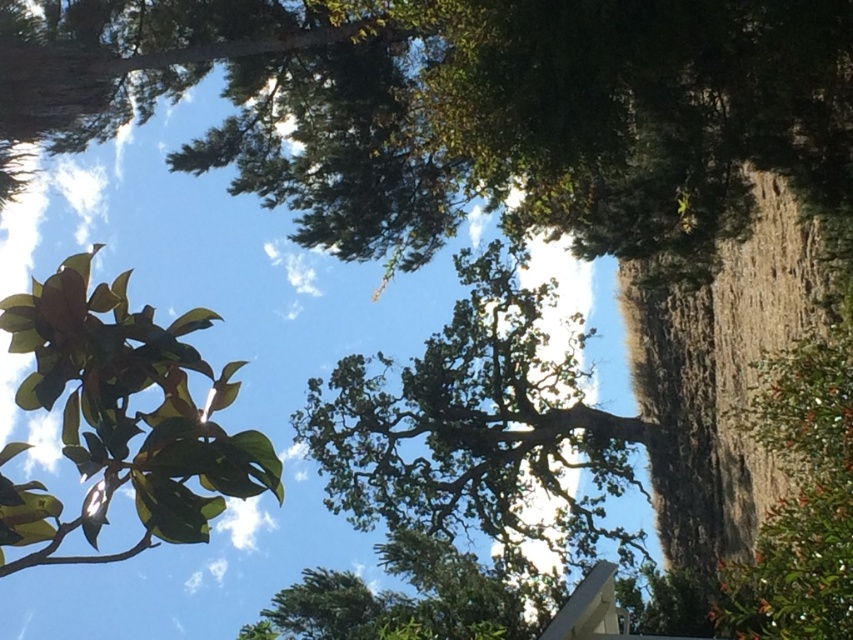
Identify the location of green leafy tree at center. (474, 424).

Is green leafy tree at center smaller than green leafy tree at lower right?

No, green leafy tree at center is not smaller than green leafy tree at lower right.

Which is behind, point (523, 502) or point (831, 624)?

Point (523, 502)

This screenshot has width=853, height=640. Find the location of `green leafy tree at center`. green leafy tree at center is located at coordinates 474,424.

Who is lower down, green leafy tree at center or green glossy leaves at upper left?

green leafy tree at center

Is green leafy tree at center smaller than green glossy leaves at upper left?

Actually, green leafy tree at center might be larger than green glossy leaves at upper left.

Image resolution: width=853 pixels, height=640 pixels. What do you see at coordinates (474, 424) in the screenshot? I see `green leafy tree at center` at bounding box center [474, 424].

The width and height of the screenshot is (853, 640). Find the location of `green leafy tree at center`. green leafy tree at center is located at coordinates click(x=474, y=424).

Measure the distance between green glossy leaves at upper left and camera.

They are 3.49 meters apart.

Who is more distant from viewer, (207, 365) or (844, 604)?

Point (844, 604)

At what (x,y) coordinates should I click in order to perform the action: click on green glossy leaves at upper left. Please return your answer as a coordinate pair (x, y). Image resolution: width=853 pixels, height=640 pixels. Looking at the image, I should click on (123, 419).

Locate an element on the screen. This screenshot has width=853, height=640. green glossy leaves at upper left is located at coordinates (123, 419).